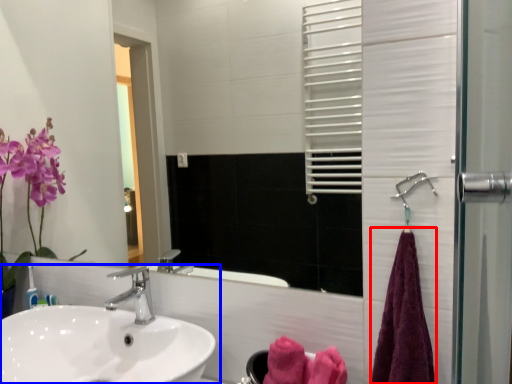
Question: Which point is further to the camera, bath towel (highlighted by a red box) or sink (highlighted by a blue box)?

Choices:
 (A) bath towel
 (B) sink

Answer: (A)